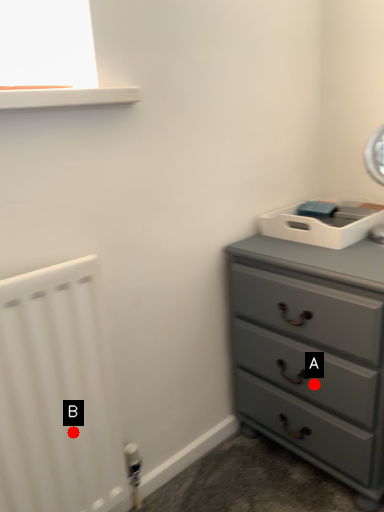
Question: Two points are circled on the image, labeled by A and B beside each circle. Which point appears closest to the camera in this image?

Choices:
 (A) A is closer
 (B) B is closer

Answer: (B)